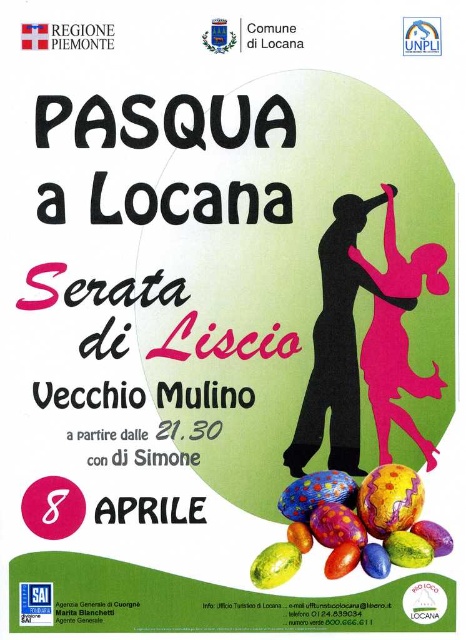
Question: Which point is closer to the camera?

Choices:
 (A) (258, 580)
 (B) (340, 477)

Answer: (A)

Question: Can you confirm if multicolored glossy easter egg at lower right is positioned to the right of polka dot glossy easter egg at lower right?

Choices:
 (A) no
 (B) yes

Answer: (B)

Question: In this image, where is multicolored glossy easter egg at lower right located relative to matte yellow easter egg at lower center?

Choices:
 (A) left
 (B) right

Answer: (B)

Question: Which of the following is the closest to the observer?

Choices:
 (A) (274, 586)
 (B) (364, 497)

Answer: (A)

Question: Which of the following is the farthest from the observer?

Choices:
 (A) (315, 424)
 (B) (424, 493)
 (C) (335, 500)

Answer: (A)

Question: Can you confirm if black matte figure at center is positioned to the right of multicolored glossy easter egg at lower right?

Choices:
 (A) no
 (B) yes

Answer: (A)